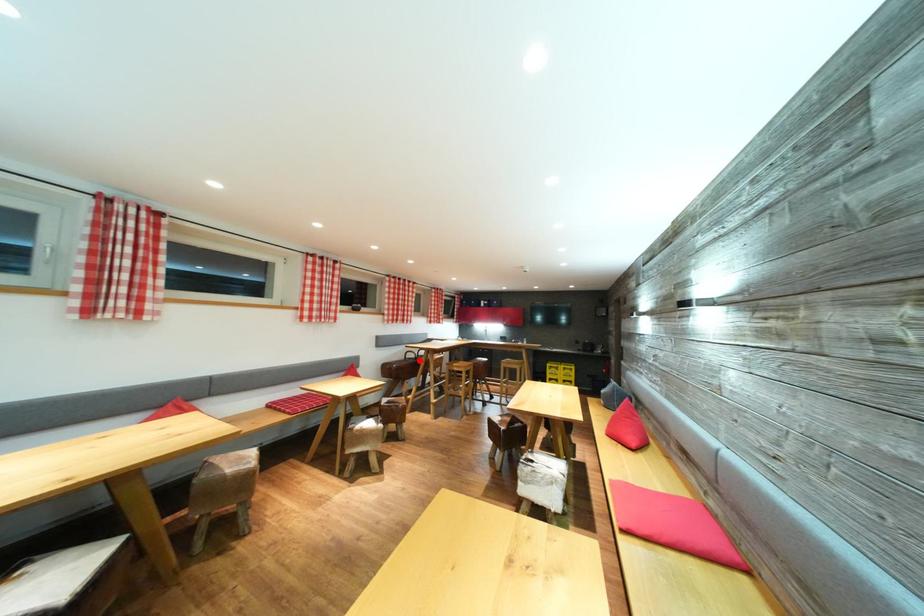
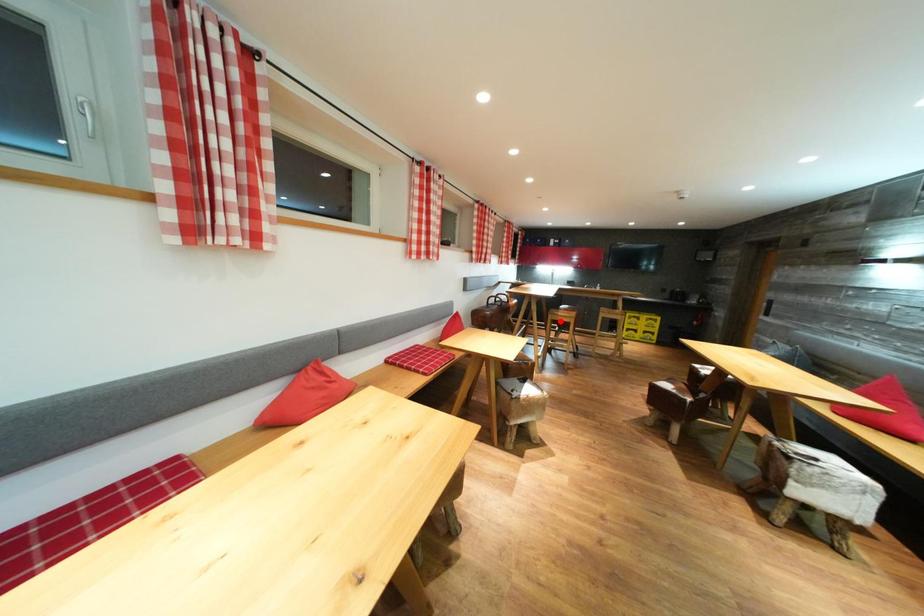
I am providing you with two images of the same scene from different viewpoints. A red point is marked on the first image and another point is marked on the second image. Are the points marked in image1 and image2 representing the same 3D position?

No